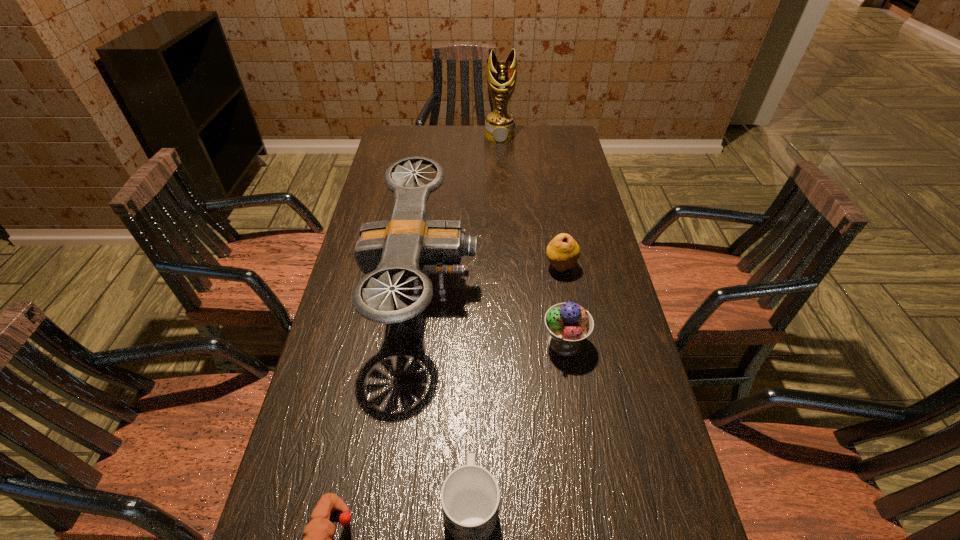
This screenshot has height=540, width=960. In order to click on the farthest object in this screenshot , I will do `click(501, 75)`.

At what (x,y) coordinates should I click in order to perform the action: click on the tallest object. Please return your answer as a coordinate pair (x, y). Looking at the image, I should click on (501, 75).

Identify the location of drone. Image resolution: width=960 pixels, height=540 pixels. (407, 244).

Where is `icecream`? The height and width of the screenshot is (540, 960). icecream is located at coordinates (568, 324).

Locate an element on the screen. Image resolution: width=960 pixels, height=540 pixels. pear is located at coordinates (563, 251).

The width and height of the screenshot is (960, 540). In order to click on vacant space located 0.110m on the front-facing side of the farthest object in this screenshot , I will do `click(501, 158)`.

Locate an element on the screen. free space located on the front-facing side of the fifth shortest object is located at coordinates 502,284.

This screenshot has width=960, height=540. I want to click on free space located 0.250m on the back of the icecream, so click(x=550, y=256).

You are a GUI agent. You are given a task and a screenshot of the screen. Output one action in this format:
    pyautogui.click(x=<x>, y=<y>)
    Task: Click on the vacant space located 0.220m on the left of the pear
    The image size is (960, 540).
    Given the screenshot: What is the action you would take?
    pyautogui.click(x=467, y=267)

Locate an element on the screen. object at the far edge is located at coordinates (501, 75).